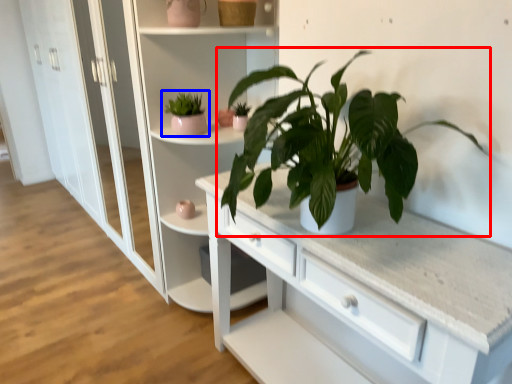
Question: Which object appears closest to the camera in this image, houseplant (highlighted by a red box) or houseplant (highlighted by a blue box)?

Choices:
 (A) houseplant
 (B) houseplant

Answer: (A)